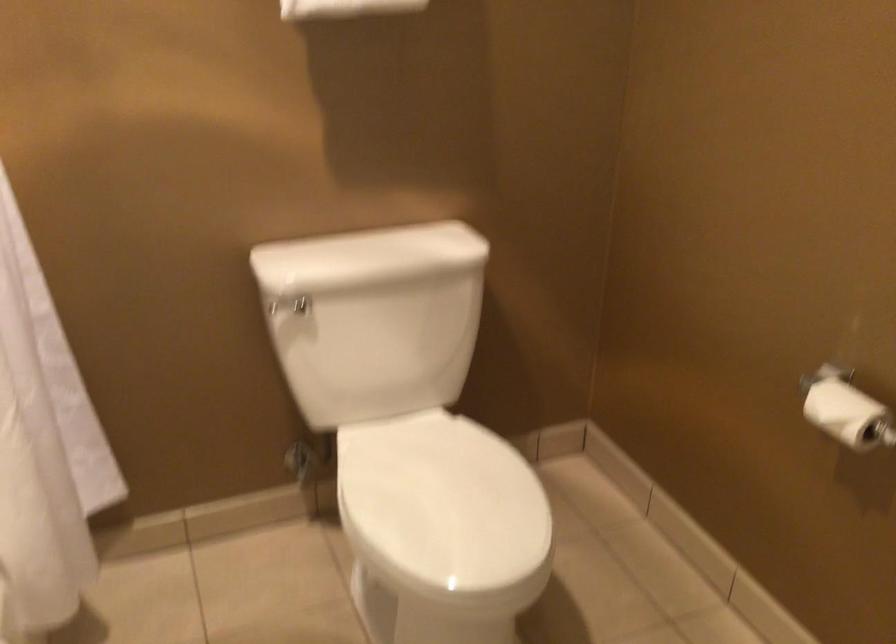
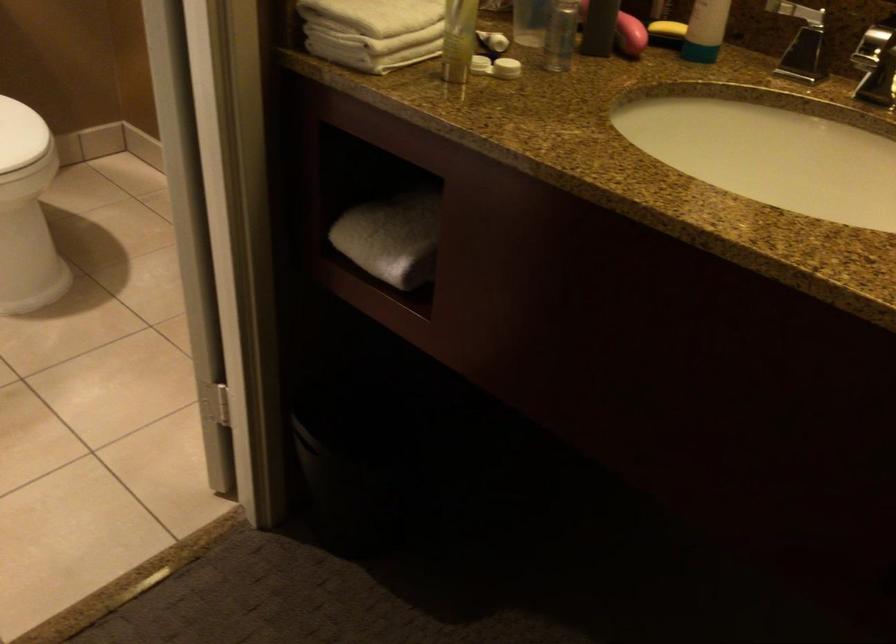
Where in the second image is the point corresponding to (515,524) from the first image?

(20, 135)